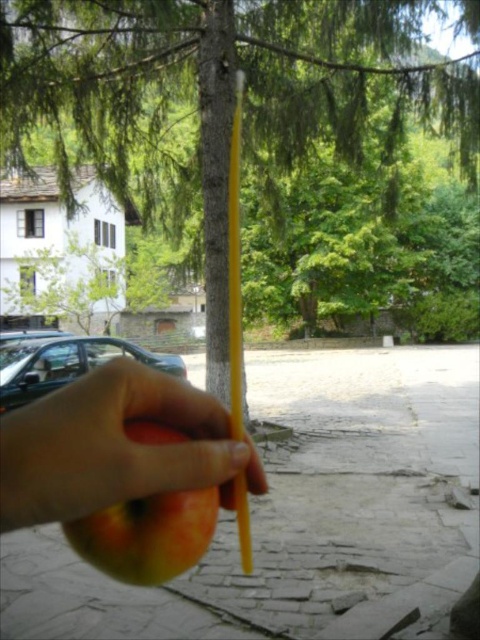
Question: Which of the following is the closest to the observer?

Choices:
 (A) green textured tree at center
 (B) ripe yellow apple at center
 (C) smooth orange at center

Answer: (C)

Question: Does smooth orange at center have a lesser width compared to ripe yellow apple at center?

Choices:
 (A) yes
 (B) no

Answer: (B)

Question: Is green textured tree at center positioned before ripe yellow apple at center?

Choices:
 (A) no
 (B) yes

Answer: (A)

Question: Is green textured tree at center below smooth orange at center?

Choices:
 (A) no
 (B) yes

Answer: (A)

Question: Which of the following is the farthest from the observer?

Choices:
 (A) ripe yellow apple at center
 (B) smooth orange at center
 (C) green textured tree at center

Answer: (C)

Question: Which point is farther to the camera?

Choices:
 (A) green textured tree at center
 (B) ripe yellow apple at center

Answer: (A)